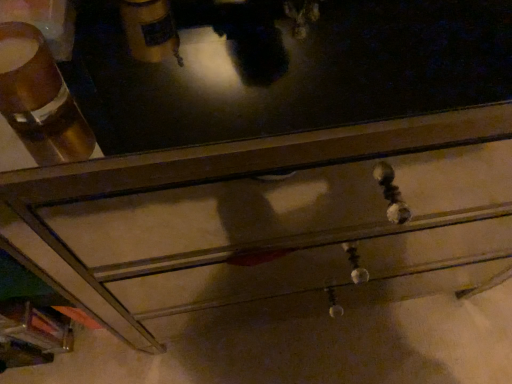
I want to click on matte brown cup at upper left, so click(30, 83).

What do you see at coordinates (30, 83) in the screenshot?
I see `matte brown cup at upper left` at bounding box center [30, 83].

Locate an element on the screen. This screenshot has height=384, width=512. metallic drawer at center is located at coordinates pyautogui.click(x=256, y=154).

What do you see at coordinates (256, 154) in the screenshot? The image size is (512, 384). I see `metallic drawer at center` at bounding box center [256, 154].

Locate an element on the screen. The height and width of the screenshot is (384, 512). matte brown cup at upper left is located at coordinates click(x=30, y=83).

Looking at this image, is matte brown cup at upper left to the left or to the right of metallic drawer at center in the image?

From the image, it's evident that matte brown cup at upper left is to the left of metallic drawer at center.

In the scene shown: Who is more distant, matte brown cup at upper left or metallic drawer at center?

metallic drawer at center is further from the camera.

Is point (54, 75) in front of point (79, 192)?

Yes, point (54, 75) is in front of point (79, 192).

From the image's perspective, does matte brown cup at upper left appear higher than metallic drawer at center?

Yes, from the image's perspective, matte brown cup at upper left is over metallic drawer at center.

From a real-world perspective, does matte brown cup at upper left stand above metallic drawer at center?

Yes, from a real-world perspective, matte brown cup at upper left is over metallic drawer at center

Which object is wider, matte brown cup at upper left or metallic drawer at center?

metallic drawer at center.

From their relative heights in the image, would you say matte brown cup at upper left is taller or shorter than metallic drawer at center?

matte brown cup at upper left is shorter than metallic drawer at center.

Can you confirm if matte brown cup at upper left is smaller than metallic drawer at center?

Yes, matte brown cup at upper left is smaller than metallic drawer at center.

Is matte brown cup at upper left inside the boundaries of metallic drawer at center, or outside?

matte brown cup at upper left exists outside the volume of metallic drawer at center.

Based on the photo, is matte brown cup at upper left directly adjacent to metallic drawer at center?

matte brown cup at upper left and metallic drawer at center are clearly separated.

Is matte brown cup at upper left oriented away from metallic drawer at center?

That's not correct — matte brown cup at upper left is not looking away from metallic drawer at center.

Can you tell me how much matte brown cup at upper left and metallic drawer at center differ in facing direction?

The angular difference between matte brown cup at upper left and metallic drawer at center is 1.88 degrees.

At what (x,y) coordinates should I click in order to perform the action: click on the chest of drawers behind the matte brown cup at upper left. Please return your answer as a coordinate pair (x, y). Looking at the image, I should click on (256, 154).

Is metallic drawer at center at the right side of matte brown cup at upper left?

Yes.

Does metallic drawer at center lie in front of matte brown cup at upper left?

No.

Does point (441, 131) come in front of point (25, 80)?

No, (441, 131) is behind (25, 80).

From the image's perspective, is metallic drawer at center under matte brown cup at upper left?

Yes, from the image's perspective, metallic drawer at center is below matte brown cup at upper left.

From a real-world perspective, is metallic drawer at center positioned over matte brown cup at upper left based on gravity?

No, from a real-world perspective, metallic drawer at center is not over matte brown cup at upper left

Is metallic drawer at center thinner than matte brown cup at upper left?

Incorrect, the width of metallic drawer at center is not less than that of matte brown cup at upper left.

Between metallic drawer at center and matte brown cup at upper left, which one has more height?

metallic drawer at center is taller.

Who is bigger, metallic drawer at center or matte brown cup at upper left?

Bigger between the two is metallic drawer at center.

Is matte brown cup at upper left completely or partially inside metallic drawer at center?

No.

Is metallic drawer at center with matte brown cup at upper left?

No.

Could you tell me if metallic drawer at center is facing matte brown cup at upper left?

No, metallic drawer at center does not turn towards matte brown cup at upper left.

How different are the orientations of metallic drawer at center and matte brown cup at upper left in degrees?

1.88 degrees separate the facing orientations of metallic drawer at center and matte brown cup at upper left.

At what (x,y) coordinates should I click in order to perform the action: click on chest of drawers below the matte brown cup at upper left (from a real-world perspective). Please return your answer as a coordinate pair (x, y). Looking at the image, I should click on (256, 154).

Where is `the chest of drawers lying below the matte brown cup at upper left (from the image's perspective)`? This screenshot has width=512, height=384. the chest of drawers lying below the matte brown cup at upper left (from the image's perspective) is located at coordinates (256, 154).

Locate an element on the screen. This screenshot has width=512, height=384. chest of drawers on the right of matte brown cup at upper left is located at coordinates (256, 154).